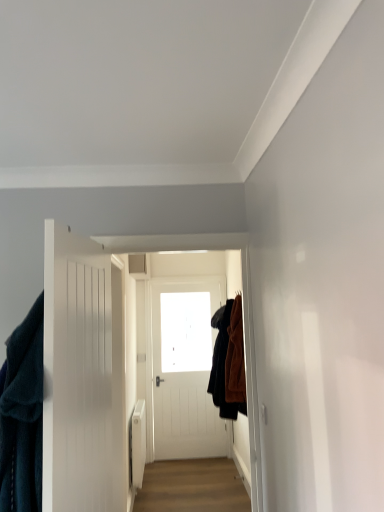
Question: From a real-world perspective, is transparent glass window at center above or below light brown wood floor at center?

Choices:
 (A) below
 (B) above

Answer: (B)

Question: Is transparent glass window at center bigger or smaller than light brown wood floor at center?

Choices:
 (A) small
 (B) big

Answer: (A)

Question: Estimate the real-world distances between objects in this image. Which object is closer to the velvet brown coat at right, the 2th clothing positioned from the front?

Choices:
 (A) transparent glass window at center
 (B) white wooden door at left
 (C) velvety dark blue robe at left, placed as the 2th clothing when sorted from right to left
 (D) light brown wood floor at center

Answer: (D)

Question: Which object is the closest to the light brown wood floor at center?

Choices:
 (A) velvety dark blue robe at left, the 2th clothing when ordered from back to front
 (B) velvet brown coat at right, placed as the 2th clothing when sorted from left to right
 (C) white wooden door at left
 (D) transparent glass window at center

Answer: (B)